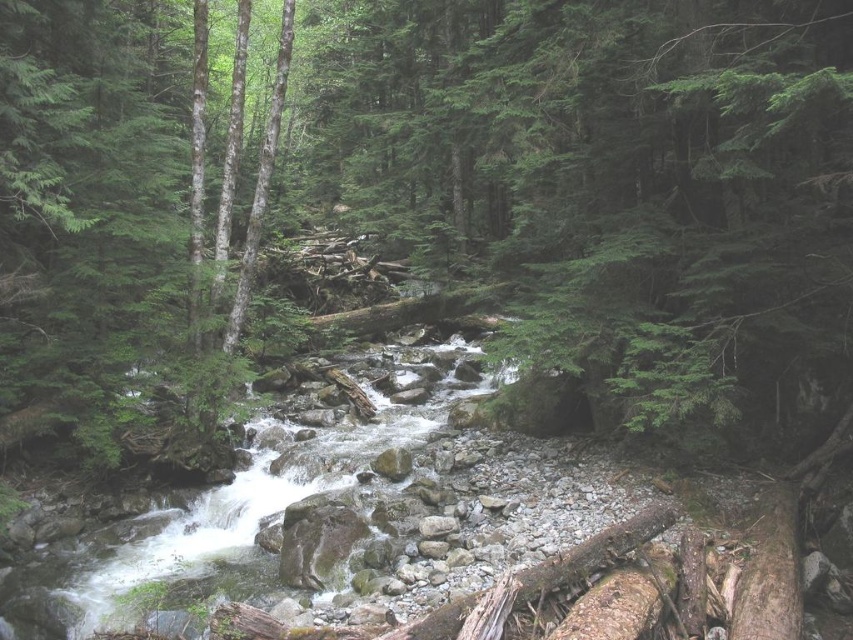
You are a hiker who wants to cross the stream safely. You see the green matte tree at center and the white frothy water at center. Which object should you avoid stepping on to prevent slipping?

You should avoid stepping on the white frothy water at center because it is slippery and located below the green matte tree at center.